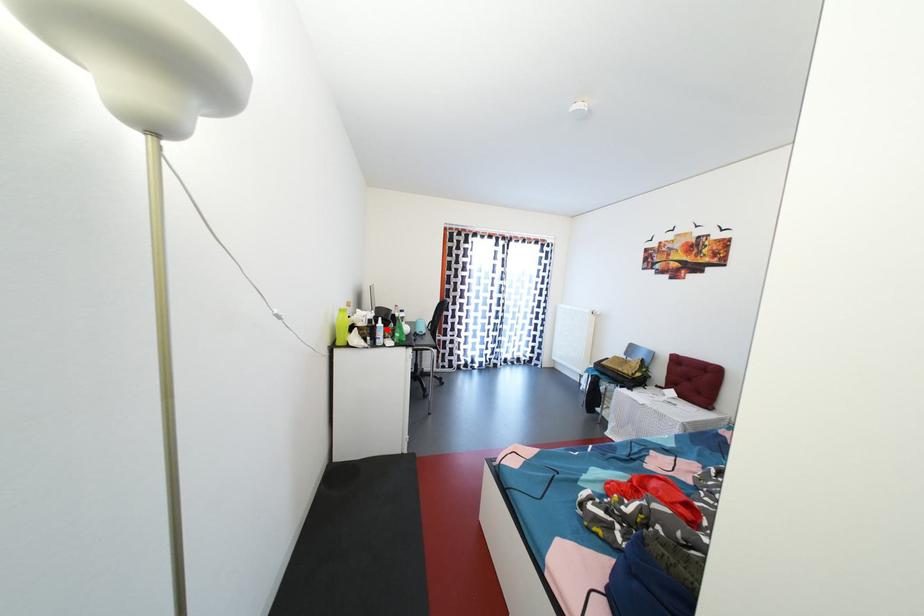
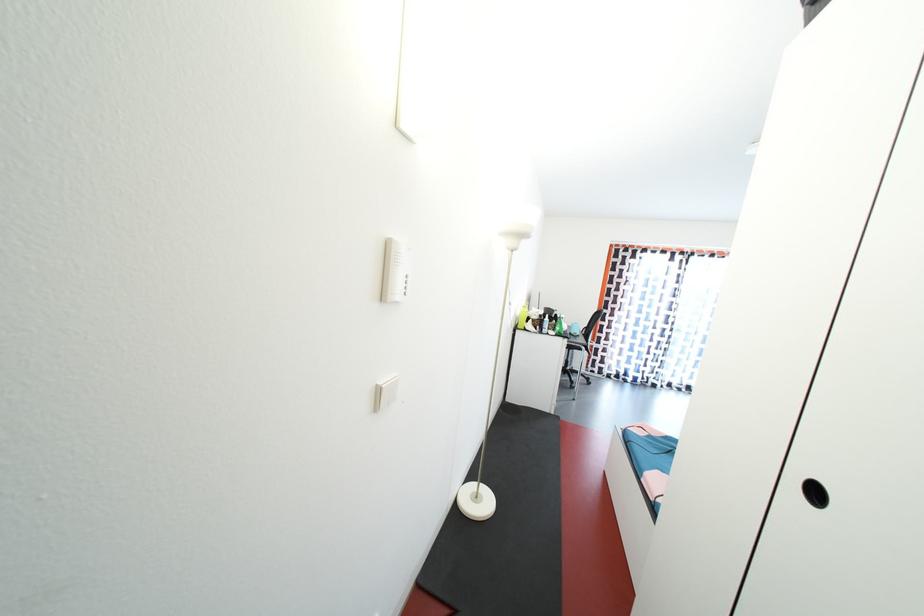
Locate, in the second image, the point that corresponds to the highlighted location in the first image.

(553, 323)